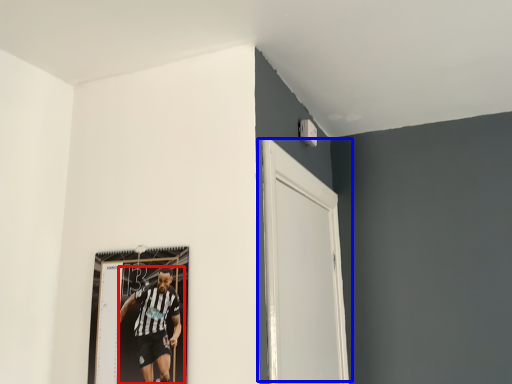
Question: Among these objects, which one is farthest to the camera, person (highlighted by a red box) or door (highlighted by a blue box)?

Choices:
 (A) person
 (B) door

Answer: (A)